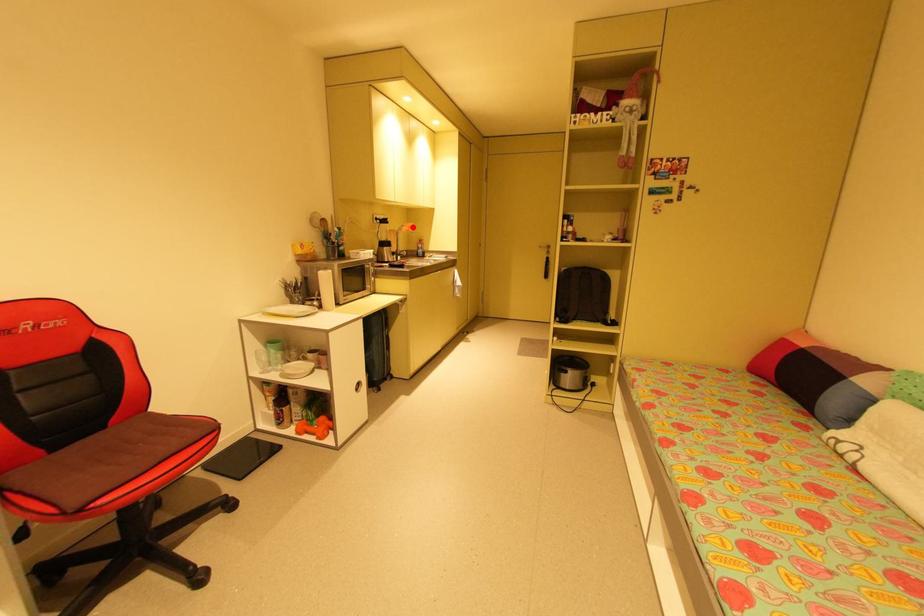
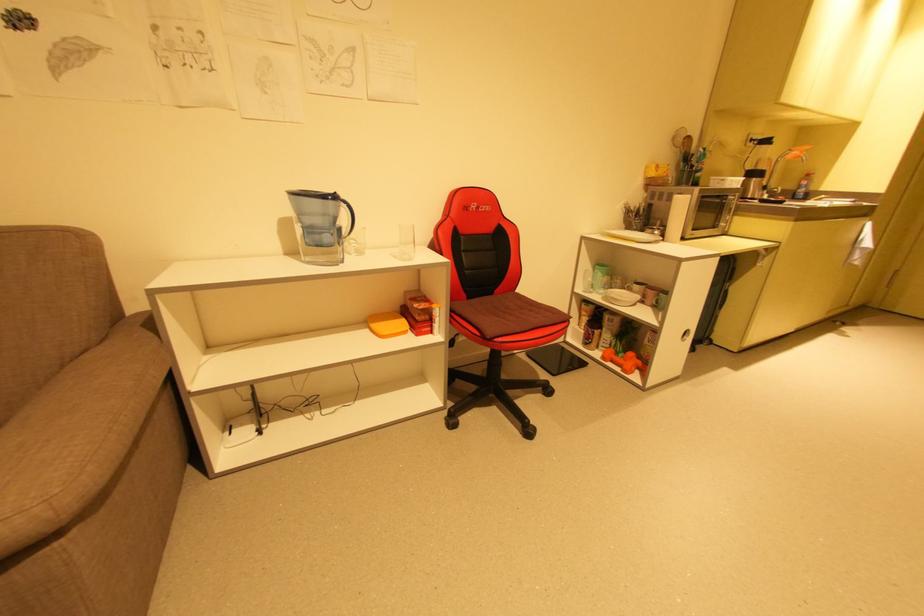
Find the pixel in the second image that matches the highlighted location in the first image.

(805, 152)